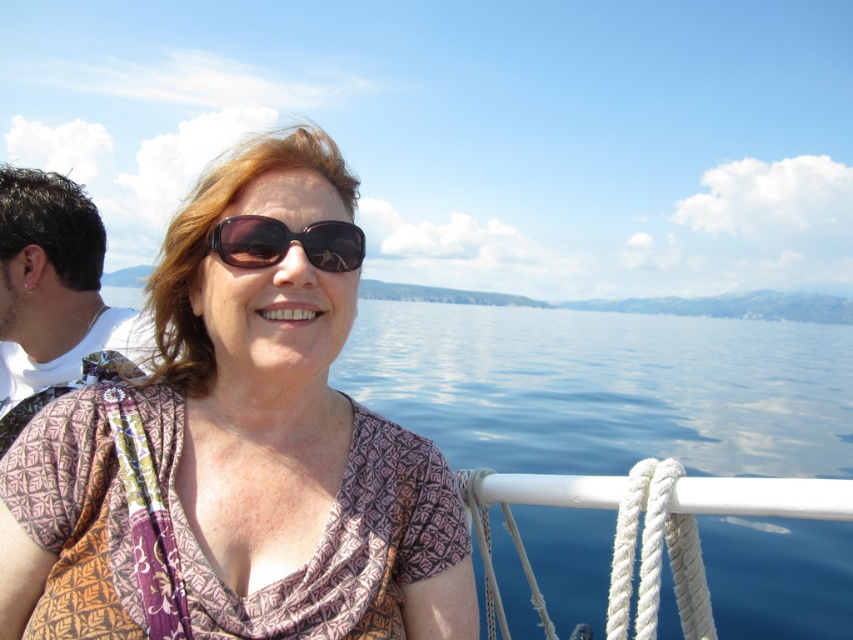
Between point (463, 637) and point (22, 316), which one is positioned in front?

Point (463, 637) is more forward.

Between matte brown blouse at center and white fabric at left, which one is positioned lower?

matte brown blouse at center is below.

Is point (418, 481) positioned before point (28, 176)?

Yes, it is.

The image size is (853, 640). I want to click on matte brown blouse at center, so click(236, 456).

In the scene shown: Does matte brown blouse at center have a smaller size compared to matte brown sunglasses at center?

Incorrect, matte brown blouse at center is not smaller in size than matte brown sunglasses at center.

Who is more forward, (305,209) or (251,253)?

Point (251,253)

Where is `matte brown blouse at center`? The image size is (853, 640). matte brown blouse at center is located at coordinates 236,456.

Is white fabric at left positioned behind matte brown sunglasses at center?

Yes, white fabric at left is behind matte brown sunglasses at center.

Who is taller, white fabric at left or matte brown sunglasses at center?

With more height is white fabric at left.

Between point (82, 230) and point (253, 225), which one is positioned behind?

Positioned behind is point (82, 230).

You are a GUI agent. You are given a task and a screenshot of the screen. Output one action in this format:
    pyautogui.click(x=<x>, y=<y>)
    Task: Click on the white fabric at left
    This screenshot has height=640, width=853.
    Given the screenshot: What is the action you would take?
    pyautogui.click(x=54, y=298)